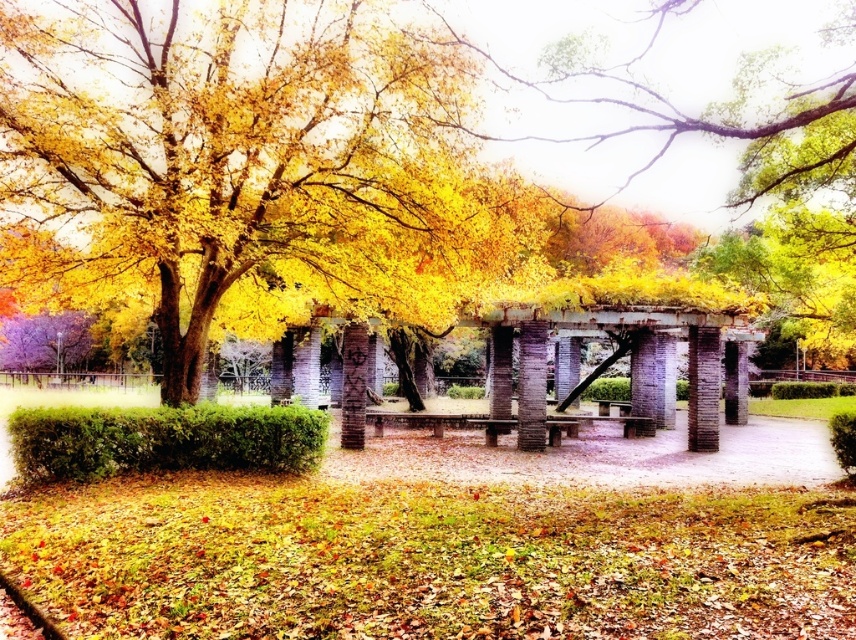
Is green leafy hedge at lower left smaller than gray stone column at center?

Incorrect, green leafy hedge at lower left is not smaller in size than gray stone column at center.

Can you confirm if green leafy hedge at lower left is positioned to the left of gray stone column at center?

Correct, you'll find green leafy hedge at lower left to the left of gray stone column at center.

Does point (49, 476) come closer to viewer compared to point (694, 380)?

Yes.

The image size is (856, 640). I want to click on green leafy hedge at lower left, so click(x=162, y=440).

Between green leafy hedge at lower left and brick textured pillar at center, which one is positioned higher?

brick textured pillar at center is above.

Which is below, green leafy hedge at lower left or brick textured pillar at center?

green leafy hedge at lower left is lower down.

Is point (74, 445) positioned in front of point (354, 337)?

Yes, it is in front of point (354, 337).

Where is `green leafy hedge at lower left`? green leafy hedge at lower left is located at coordinates (162, 440).

Which of these two, gray stone column at center or brick textured pillar at center, stands shorter?

With less height is brick textured pillar at center.

The width and height of the screenshot is (856, 640). Describe the element at coordinates (702, 388) in the screenshot. I see `gray stone column at center` at that location.

I want to click on gray stone column at center, so click(702, 388).